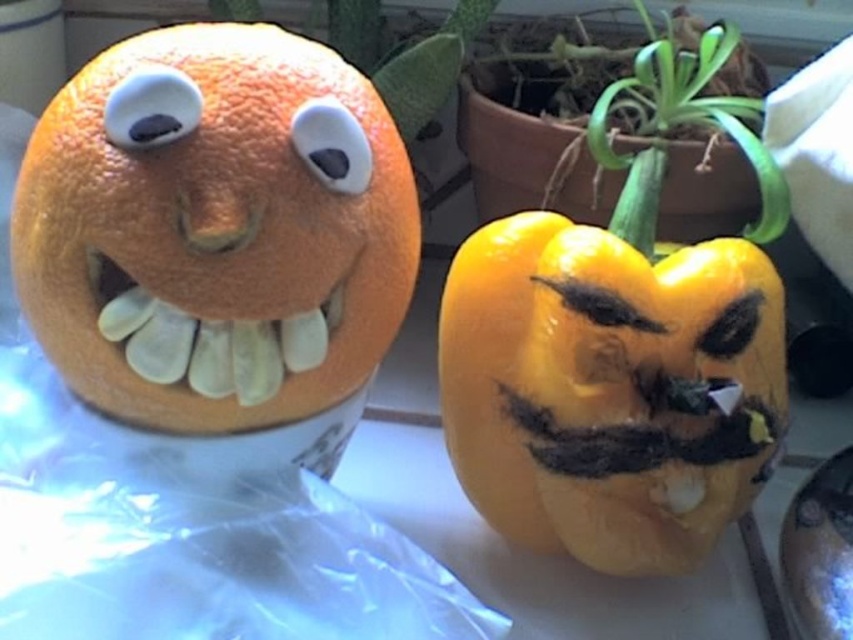
Question: Can you confirm if matte plastic eye at upper left is bigger than black matte eye at center?

Choices:
 (A) yes
 (B) no

Answer: (A)

Question: Which point is farther from the camera taking this photo?

Choices:
 (A) (161, 83)
 (B) (38, 200)
 (C) (631, 433)

Answer: (C)

Question: Where is orange matte fruit at left located in relation to black matte eye at center in the image?

Choices:
 (A) left
 (B) right

Answer: (A)

Question: In this image, where is green leafy plant at center located relative to black matte eye at center?

Choices:
 (A) right
 (B) left

Answer: (A)

Question: Among these objects, which one is nearest to the camera?

Choices:
 (A) white matte eye at center
 (B) matte plastic eye at upper left
 (C) orange matte fruit at left
 (D) yellow matte bell pepper at center

Answer: (C)

Question: Among these points, which one is farthest from the camera?

Choices:
 (A) pos(596,268)
 (B) pos(718,208)
 (C) pos(746,333)
 (D) pos(183,99)

Answer: (B)